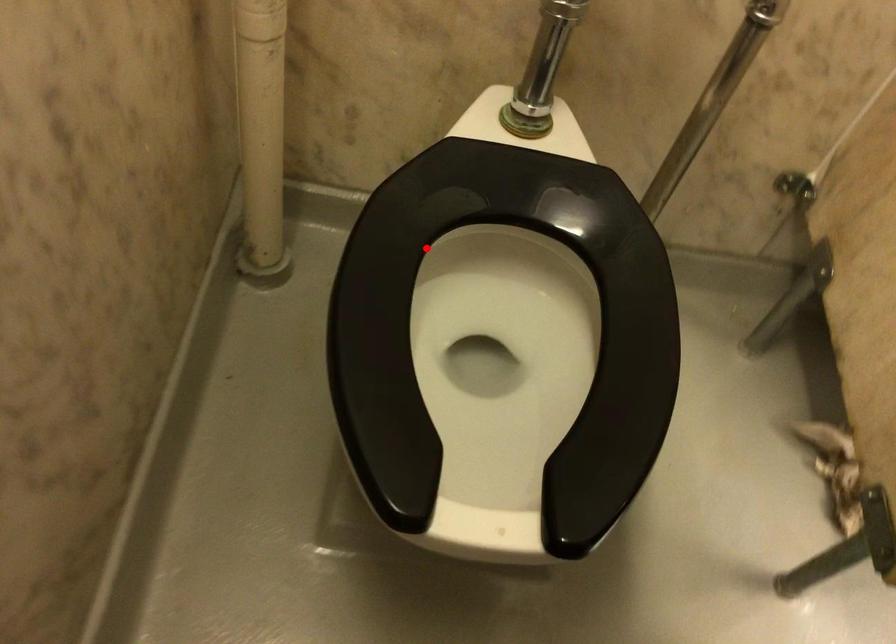
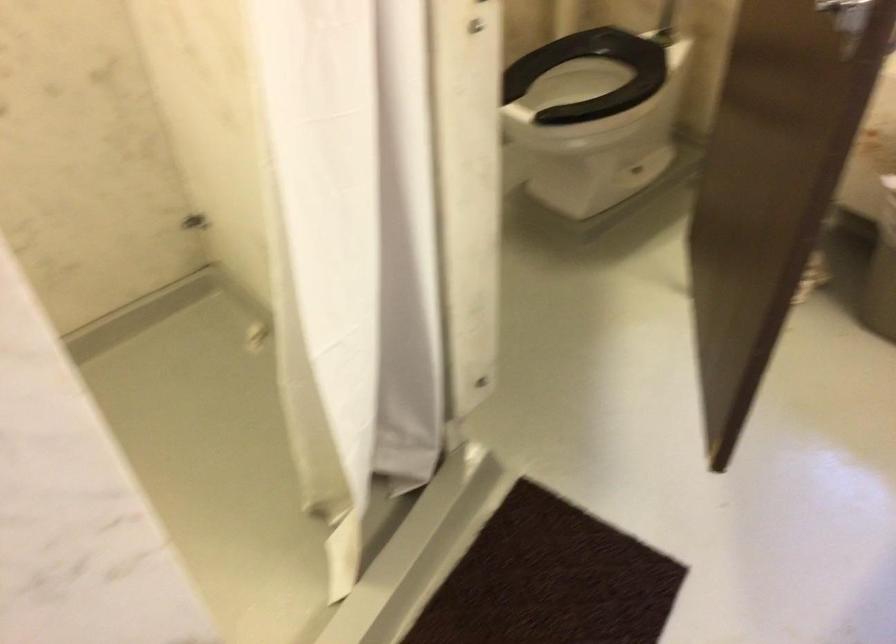
Question: I am providing you with two images of the same scene from different viewpoints. A red point is shown in image1. For the corresponding object point in image2, is it positioned nearer or farther from the camera?

Choices:
 (A) Nearer
 (B) Farther

Answer: (B)